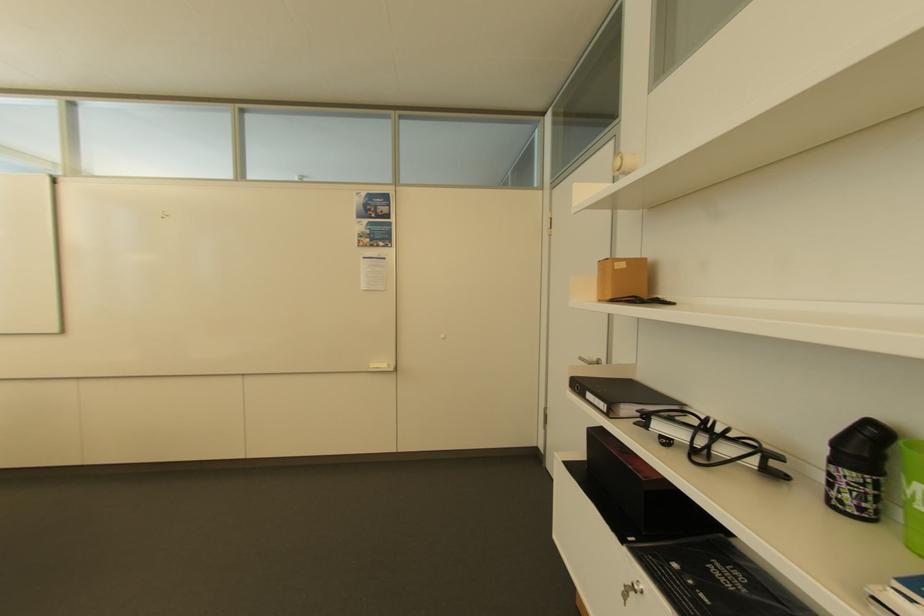
Locate an element on the screen. The height and width of the screenshot is (616, 924). whiteboard eraser is located at coordinates (380, 365).